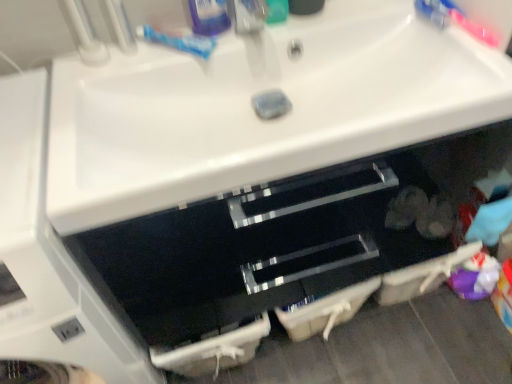
Locate an element on the screen. This screenshot has width=512, height=384. blue glossy toothpaste tube at upper center, marked as the second toiletry in a right-to-left arrangement is located at coordinates (209, 16).

Locate an element on the screen. pink plastic toothbrush at upper right is located at coordinates [x=454, y=19].

Where is `matte plastic faucet at upper center`? This screenshot has height=384, width=512. matte plastic faucet at upper center is located at coordinates (255, 37).

The height and width of the screenshot is (384, 512). I want to click on blue glossy toothpaste tube at upper center, marked as the second toiletry in a right-to-left arrangement, so click(x=209, y=16).

Does blue glossy toothpaste tube at upper center, marked as the second toiletry in a right-to-left arrangement, have a lesser width compared to green plastic toothpaste tube at upper center, the 1th toiletry in the right-to-left sequence?

No.

Which of these two, blue glossy toothpaste tube at upper center, marked as the second toiletry in a right-to-left arrangement, or green plastic toothpaste tube at upper center, the 2th toiletry viewed from the left, stands shorter?

With less height is green plastic toothpaste tube at upper center, the 2th toiletry viewed from the left.

Looking at this image, from the image's perspective, is blue glossy toothpaste tube at upper center, marked as the second toiletry in a right-to-left arrangement, on top of green plastic toothpaste tube at upper center, the 2th toiletry viewed from the left?

Yes.

Looking at this image, is blue glossy toothpaste tube at upper center, the 1th toiletry when ordered from left to right, next to green plastic toothpaste tube at upper center, the 2th toiletry viewed from the left, and touching it?

A: blue glossy toothpaste tube at upper center, the 1th toiletry when ordered from left to right, and green plastic toothpaste tube at upper center, the 2th toiletry viewed from the left, are not in contact.

Is blue glossy toothpaste tube at upper center, marked as the second toiletry in a right-to-left arrangement, far away from blue matte toothpaste at upper center?

No, blue glossy toothpaste tube at upper center, marked as the second toiletry in a right-to-left arrangement, is not far away from blue matte toothpaste at upper center.

From a real-world perspective, which is physically below, blue glossy toothpaste tube at upper center, marked as the second toiletry in a right-to-left arrangement, or blue matte toothpaste at upper center?

blue matte toothpaste at upper center, from a real-world perspective.

Locate an element on the screen. The width and height of the screenshot is (512, 384). toiletry that is in front of the blue matte toothpaste at upper center is located at coordinates (209, 16).

Between matte plastic faucet at upper center and white glossy sink at center, which one has larger width?

white glossy sink at center is wider.

In the scene shown: Is matte plastic faucet at upper center placed right next to white glossy sink at center?

No, matte plastic faucet at upper center is not making contact with white glossy sink at center.

Is matte plastic faucet at upper center facing towards white glossy sink at center?

No, matte plastic faucet at upper center is not facing towards white glossy sink at center.

Considering the points (228, 18) and (444, 9), which point is in front, point (228, 18) or point (444, 9)?

Positioned in front is point (444, 9).

Identify the location of the 2nd toiletry above when counting from the pink plastic toothbrush at upper right (from the image's perspective). This screenshot has height=384, width=512. (209, 16).

Would you say blue glossy toothpaste tube at upper center, the 1th toiletry when ordered from left to right, is to the left or to the right of pink plastic toothbrush at upper right in the picture?

In the image, blue glossy toothpaste tube at upper center, the 1th toiletry when ordered from left to right, appears on the left side of pink plastic toothbrush at upper right.

Who is taller, blue glossy toothpaste tube at upper center, the 1th toiletry when ordered from left to right, or pink plastic toothbrush at upper right?

With more height is blue glossy toothpaste tube at upper center, the 1th toiletry when ordered from left to right.

From the image's perspective, which object appears higher, white glossy sink at center or blue glossy toothpaste tube at upper center, the 1th toiletry when ordered from left to right?

blue glossy toothpaste tube at upper center, the 1th toiletry when ordered from left to right, is shown above in the image.

Which of these two, white glossy sink at center or blue glossy toothpaste tube at upper center, the 1th toiletry when ordered from left to right, is wider?

white glossy sink at center is wider.

Would you say white glossy sink at center is a long distance from blue glossy toothpaste tube at upper center, the 1th toiletry when ordered from left to right?

No, there isn't a large distance between white glossy sink at center and blue glossy toothpaste tube at upper center, the 1th toiletry when ordered from left to right.

Locate an element on the screen. Image resolution: width=512 pixels, height=384 pixels. toiletry that appears on the left of white glossy sink at center is located at coordinates (209, 16).

The width and height of the screenshot is (512, 384). Find the location of `toothbrush below the matte plastic faucet at upper center (from a real-world perspective)`. toothbrush below the matte plastic faucet at upper center (from a real-world perspective) is located at coordinates (454, 19).

Is matte plastic faucet at upper center a part of pink plastic toothbrush at upper right?

No, matte plastic faucet at upper center is located outside of pink plastic toothbrush at upper right.

From a real-world perspective, between pink plastic toothbrush at upper right and matte plastic faucet at upper center, who is vertically higher?

From a 3D spatial view, matte plastic faucet at upper center is above.

In the scene shown: Who is more distant, pink plastic toothbrush at upper right or matte plastic faucet at upper center?

Positioned behind is pink plastic toothbrush at upper right.

How much distance is there between blue matte toothpaste at upper center and blue glossy toothpaste tube at upper center, marked as the second toiletry in a right-to-left arrangement?

2.87 inches.

Which is more to the left, blue matte toothpaste at upper center or blue glossy toothpaste tube at upper center, marked as the second toiletry in a right-to-left arrangement?

blue matte toothpaste at upper center is more to the left.

Where is `toiletry in front of the blue matte toothpaste at upper center`? Image resolution: width=512 pixels, height=384 pixels. toiletry in front of the blue matte toothpaste at upper center is located at coordinates (209, 16).

Considering the sizes of objects blue matte toothpaste at upper center and blue glossy toothpaste tube at upper center, the 1th toiletry when ordered from left to right, in the image provided, who is wider, blue matte toothpaste at upper center or blue glossy toothpaste tube at upper center, the 1th toiletry when ordered from left to right,?

With larger width is blue matte toothpaste at upper center.

Locate an element on the screen. toiletry that is on the left side of green plastic toothpaste tube at upper center, the 2th toiletry viewed from the left is located at coordinates (209, 16).

Image resolution: width=512 pixels, height=384 pixels. What are the coordinates of `the 2nd toiletry positioned above the blue matte toothpaste at upper center (from a real-world perspective)` in the screenshot? It's located at [x=209, y=16].

When comparing their distances from green plastic toothpaste tube at upper center, the 2th toiletry viewed from the left, does blue matte toothpaste at upper center or white glossy sink at center seem closer?

blue matte toothpaste at upper center.

From the image, which object appears to be farther from pink plastic toothbrush at upper right, green plastic toothpaste tube at upper center, the 1th toiletry in the right-to-left sequence, or white glossy sink at center?

Based on the image, white glossy sink at center appears to be further to pink plastic toothbrush at upper right.

Based on the photo, looking at the image, which one is located further to blue matte toothpaste at upper center, white glossy sink at center or green plastic toothpaste tube at upper center, the 2th toiletry viewed from the left?

white glossy sink at center is positioned further to the anchor blue matte toothpaste at upper center.

Based on their spatial positions, is matte plastic faucet at upper center or blue glossy toothpaste tube at upper center, the 1th toiletry when ordered from left to right, closer to pink plastic toothbrush at upper right?

matte plastic faucet at upper center.

Looking at the image, which one is located further to blue glossy toothpaste tube at upper center, marked as the second toiletry in a right-to-left arrangement, white glossy sink at center or green plastic toothpaste tube at upper center, the 2th toiletry viewed from the left?

The object further to blue glossy toothpaste tube at upper center, marked as the second toiletry in a right-to-left arrangement, is white glossy sink at center.

Looking at the image, which one is located further to blue glossy toothpaste tube at upper center, marked as the second toiletry in a right-to-left arrangement, white glossy sink at center or matte plastic faucet at upper center?

white glossy sink at center is further to blue glossy toothpaste tube at upper center, marked as the second toiletry in a right-to-left arrangement.

Which object lies nearer to the anchor point matte plastic faucet at upper center, blue matte toothpaste at upper center or green plastic toothpaste tube at upper center, the 2th toiletry viewed from the left?

green plastic toothpaste tube at upper center, the 2th toiletry viewed from the left, is positioned closer to the anchor matte plastic faucet at upper center.

When comparing their distances from matte plastic faucet at upper center, does blue matte toothpaste at upper center or white glossy sink at center seem further?

Among the two, white glossy sink at center is located further to matte plastic faucet at upper center.

The height and width of the screenshot is (384, 512). Find the location of `toothpaste that lies between blue glossy toothpaste tube at upper center, marked as the second toiletry in a right-to-left arrangement, and white glossy sink at center from top to bottom`. toothpaste that lies between blue glossy toothpaste tube at upper center, marked as the second toiletry in a right-to-left arrangement, and white glossy sink at center from top to bottom is located at coordinates (179, 41).

This screenshot has width=512, height=384. What are the coordinates of `faucet between blue matte toothpaste at upper center and pink plastic toothbrush at upper right in the horizontal direction` in the screenshot? It's located at (255, 37).

Locate an element on the screen. This screenshot has width=512, height=384. toiletry located between matte plastic faucet at upper center and pink plastic toothbrush at upper right in the left-right direction is located at coordinates (277, 11).

At what (x,y) coordinates should I click in order to perform the action: click on faucet between blue glossy toothpaste tube at upper center, the 1th toiletry when ordered from left to right, and pink plastic toothbrush at upper right from left to right. Please return your answer as a coordinate pair (x, y). This screenshot has width=512, height=384. Looking at the image, I should click on (255, 37).